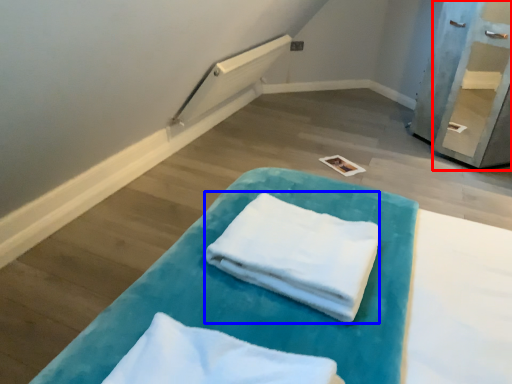
Question: Among these objects, which one is nearest to the camera, shelf (highlighted by a red box) or cloth (highlighted by a blue box)?

Choices:
 (A) shelf
 (B) cloth

Answer: (B)